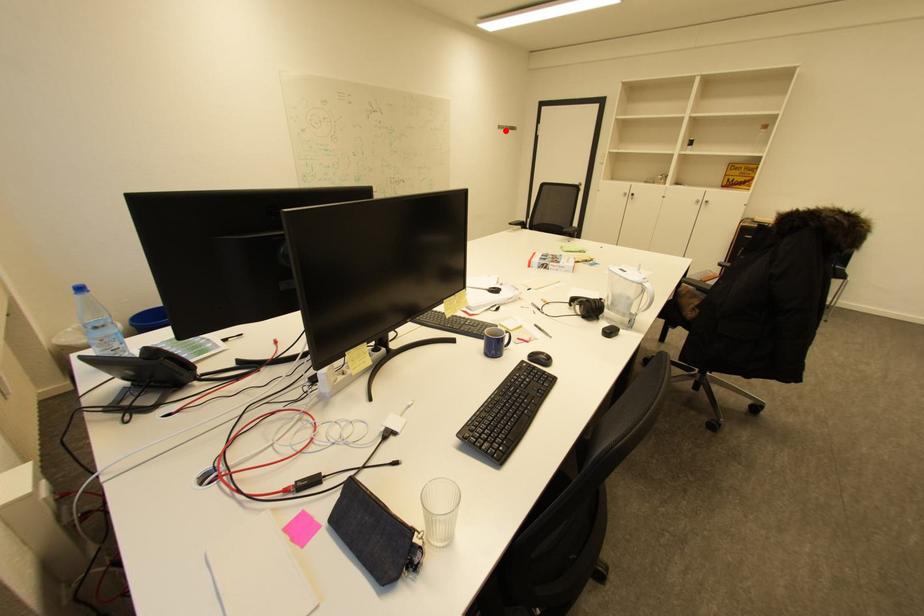
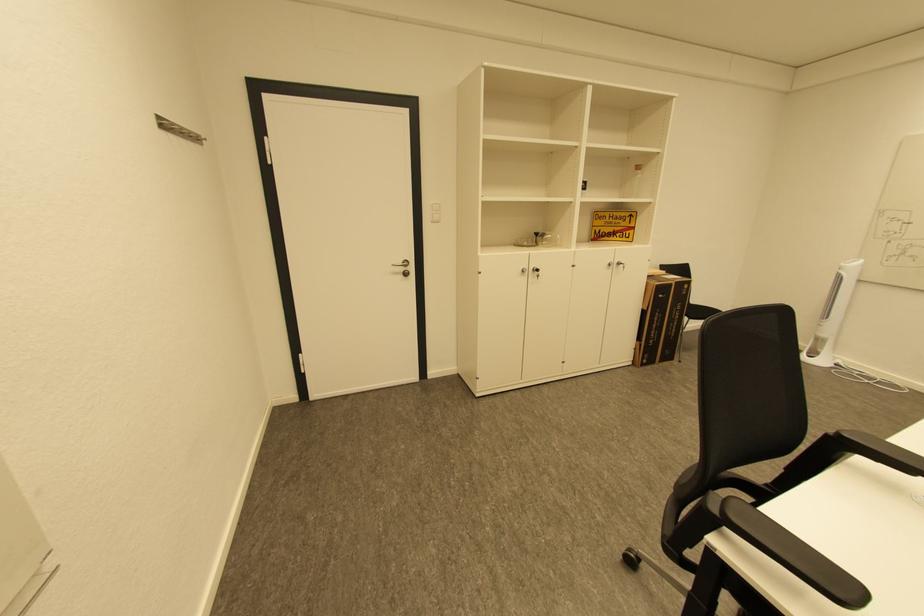
Locate, in the second image, the point that corresponds to the highlighted location in the first image.

(169, 132)